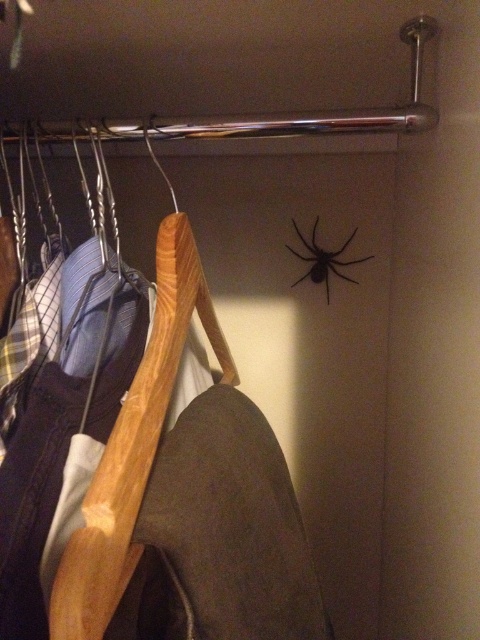
Does wooden hanger at left have a greater width compared to black matte spider at upper center?

Indeed, wooden hanger at left has a greater width compared to black matte spider at upper center.

Does wooden hanger at left have a greater height compared to black matte spider at upper center?

Yes.

Where is `wooden hanger at left`? wooden hanger at left is located at coordinates (58, 454).